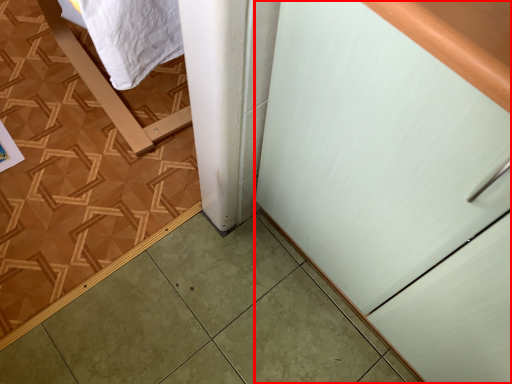
Question: From the image's perspective, what is the correct spatial positioning of cabinetry (annotated by the red box) in reference to ceramic tile?

Choices:
 (A) above
 (B) below

Answer: (B)